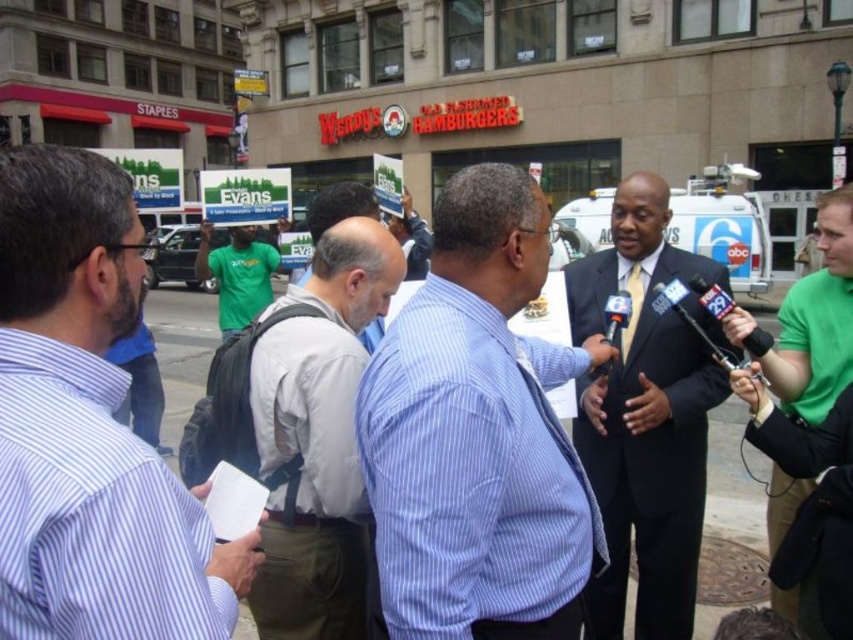
Does green fabric shirt at center have a greater width compared to black plastic microphone at right?

Yes.

Does green fabric shirt at center appear on the left side of black plastic microphone at right?

No, green fabric shirt at center is not to the left of black plastic microphone at right.

Who is more distant from viewer, (811, 291) or (700, 291)?

Positioned behind is point (811, 291).

This screenshot has height=640, width=853. I want to click on green fabric shirt at center, so click(817, 320).

Can you confirm if light gray shirt at center is shorter than gray striped shirt at center?

Yes.

Which is behind, point (317, 556) or point (316, 241)?

Point (316, 241)

Identify the location of light gray shirt at center. (305, 433).

Is green t-shirt at center above black plastic microphone at right?

Yes.

Does green t-shirt at center have a lesser height compared to black plastic microphone at right?

Incorrect, green t-shirt at center's height does not fall short of black plastic microphone at right's.

Is point (248, 262) in front of point (759, 337)?

No, it is behind (759, 337).

Locate an element on the screen. green t-shirt at center is located at coordinates (236, 275).